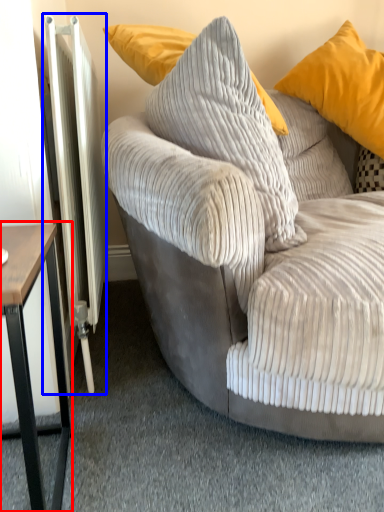
Question: Which of the following is the farthest to the observer, table (highlighted by a red box) or radiator (highlighted by a blue box)?

Choices:
 (A) table
 (B) radiator

Answer: (B)